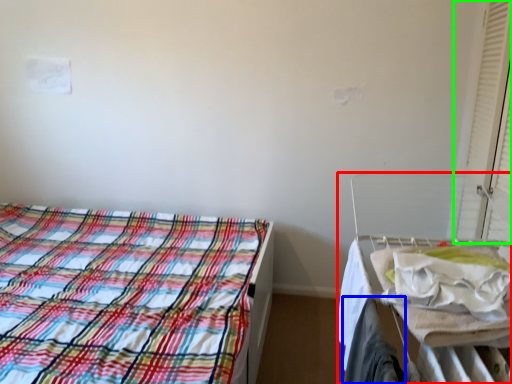
Question: Which is farther away from hospital bed (highlighted by a red box)? clothing (highlighted by a blue box) or curtain (highlighted by a green box)?

Choices:
 (A) clothing
 (B) curtain

Answer: (B)